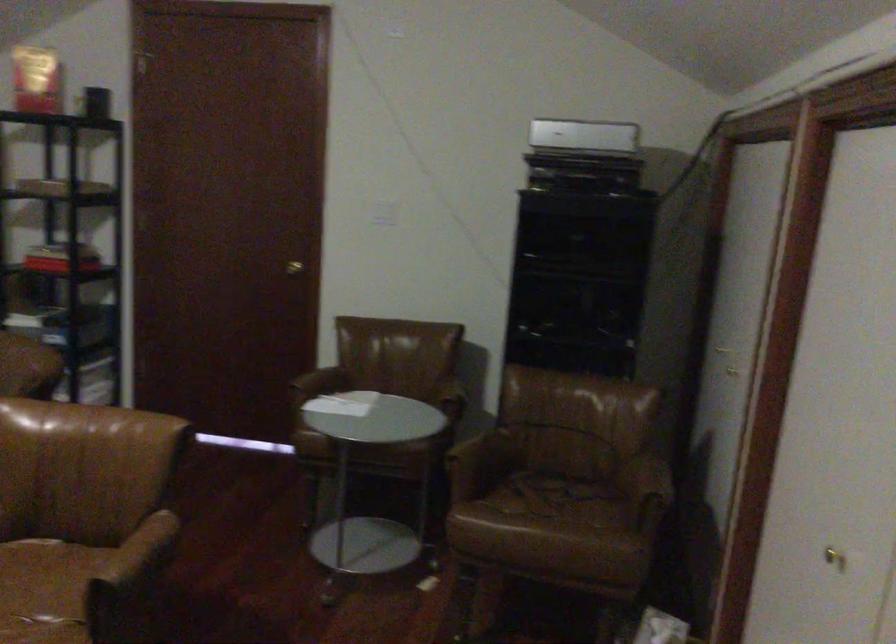
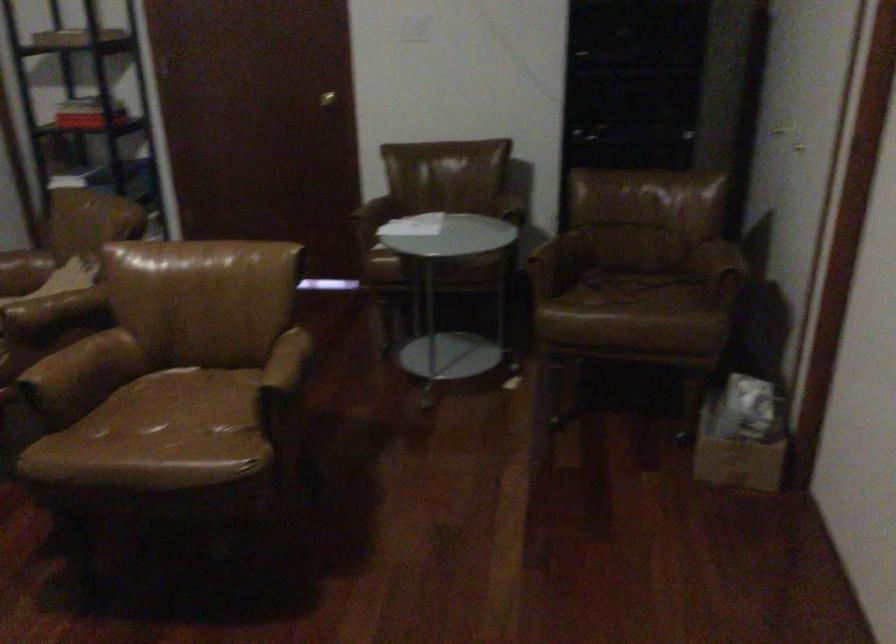
Question: In a continuous first-person perspective shot, in which direction is the camera moving?

Choices:
 (A) Left
 (B) Right
 (C) Forward
 (D) Backward

Answer: (A)